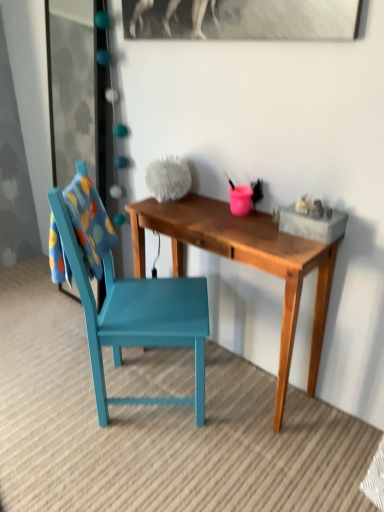
Question: Is teal painted wood chair at left to the left of transparent glass door at upper left from the viewer's perspective?

Choices:
 (A) yes
 (B) no

Answer: (B)

Question: Can you confirm if teal painted wood chair at left is shorter than transparent glass door at upper left?

Choices:
 (A) yes
 (B) no

Answer: (B)

Question: Is teal painted wood chair at left closer to the viewer compared to transparent glass door at upper left?

Choices:
 (A) no
 (B) yes

Answer: (B)

Question: Can you confirm if teal painted wood chair at left is positioned to the right of transparent glass door at upper left?

Choices:
 (A) yes
 (B) no

Answer: (A)

Question: Considering the relative sizes of teal painted wood chair at left and transparent glass door at upper left in the image provided, is teal painted wood chair at left bigger than transparent glass door at upper left?

Choices:
 (A) yes
 (B) no

Answer: (A)

Question: From a real-world perspective, is teal painted wood chair at left above or below transparent glass door at upper left?

Choices:
 (A) above
 (B) below

Answer: (B)

Question: Looking at the image, does teal painted wood chair at left seem bigger or smaller compared to transparent glass door at upper left?

Choices:
 (A) small
 (B) big

Answer: (B)

Question: Considering the positions of teal painted wood chair at left and transparent glass door at upper left in the image, is teal painted wood chair at left taller or shorter than transparent glass door at upper left?

Choices:
 (A) tall
 (B) short

Answer: (A)

Question: From the image's perspective, is teal painted wood chair at left above or below transparent glass door at upper left?

Choices:
 (A) above
 (B) below

Answer: (B)

Question: Based on their positions, is wooden desk at center located to the left or right of teal painted wood chair at left?

Choices:
 (A) right
 (B) left

Answer: (A)

Question: Looking at the image, does wooden desk at center seem bigger or smaller compared to teal painted wood chair at left?

Choices:
 (A) small
 (B) big

Answer: (A)

Question: Is wooden desk at center spatially inside teal painted wood chair at left, or outside of it?

Choices:
 (A) outside
 (B) inside

Answer: (A)

Question: Is point (316, 336) closer or farther from the camera than point (117, 320)?

Choices:
 (A) closer
 (B) farther

Answer: (B)

Question: Is transparent glass door at upper left wider or thinner than teal painted wood chair at left?

Choices:
 (A) thin
 (B) wide

Answer: (A)

Question: Is transparent glass door at upper left in front of or behind teal painted wood chair at left in the image?

Choices:
 (A) behind
 (B) front

Answer: (A)